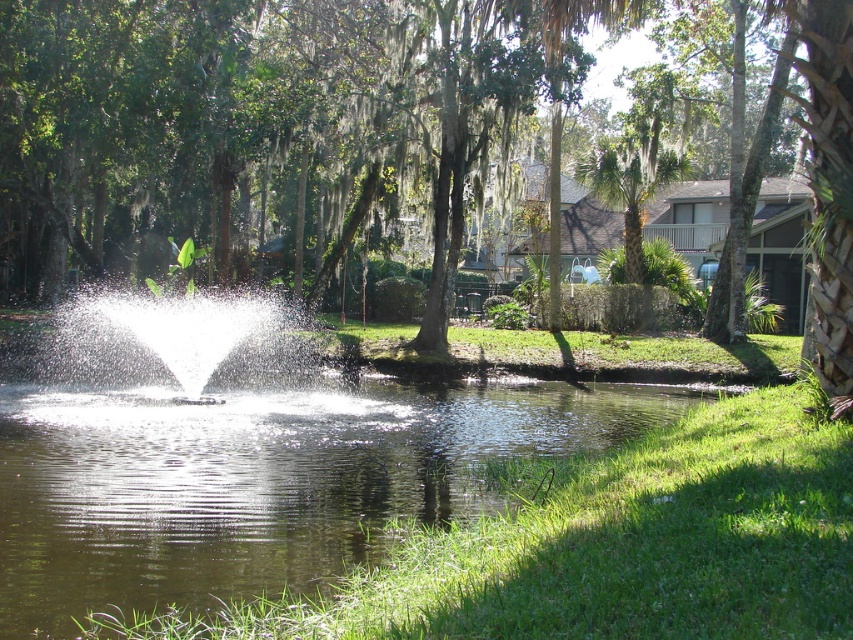
Question: Is green mossy tree at center bigger than clear water at center?

Choices:
 (A) yes
 (B) no

Answer: (A)

Question: Is clear water at center thinner than green leafy palm tree at upper right?

Choices:
 (A) no
 (B) yes

Answer: (A)

Question: Among these points, which one is farthest from the camera?

Choices:
 (A) [x=263, y=381]
 (B) [x=651, y=120]
 (C) [x=428, y=476]
 (D) [x=288, y=182]

Answer: (D)

Question: Is clear water at center positioned behind white water at center?

Choices:
 (A) yes
 (B) no

Answer: (B)

Question: Among these objects, which one is nearest to the camera?

Choices:
 (A) clear water at center
 (B) green leafy palm tree at upper right
 (C) white water at center
 (D) green mossy tree at center

Answer: (A)

Question: Considering the real-world distances, which object is farthest from the clear water at center?

Choices:
 (A) white water at center
 (B) green mossy tree at center
 (C) green leafy palm tree at upper right

Answer: (C)